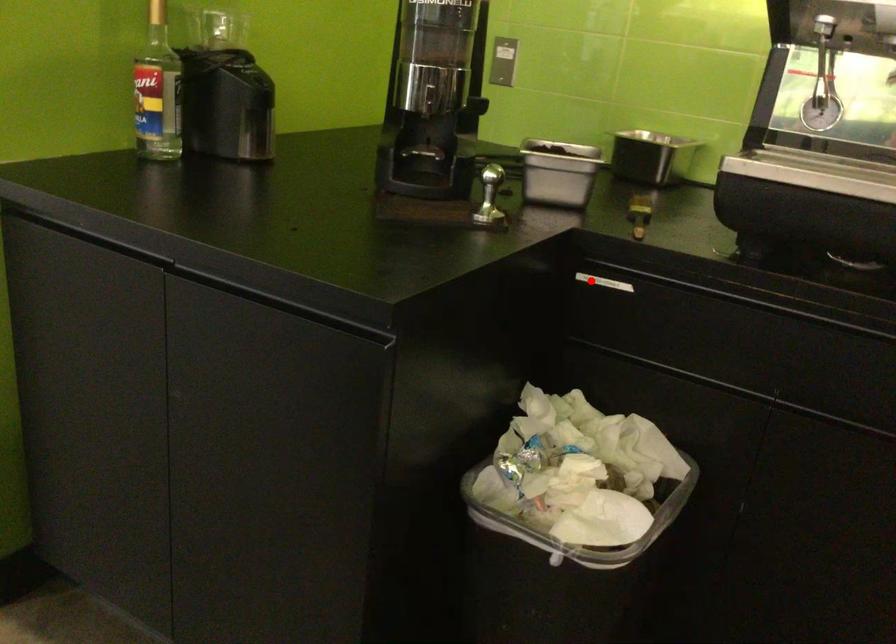
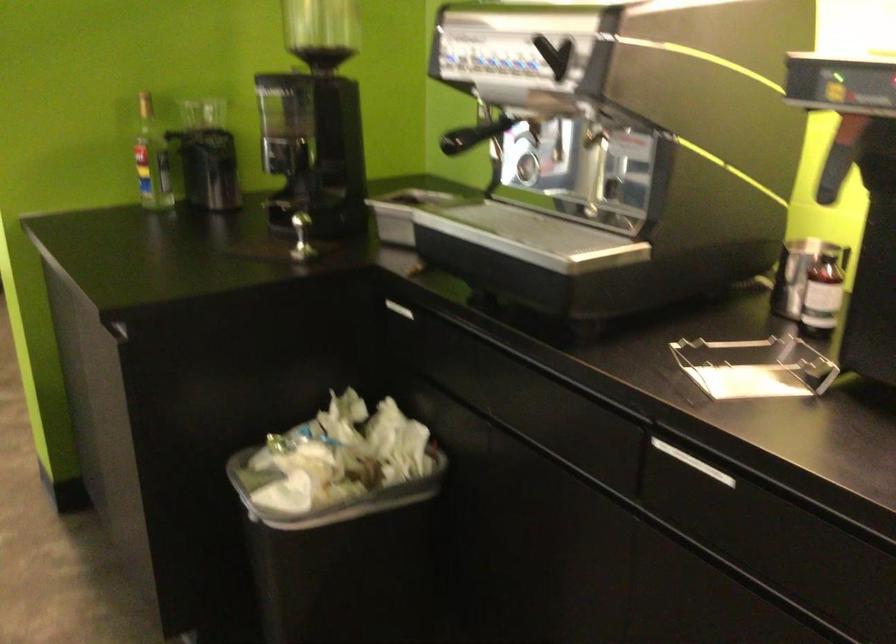
Question: I am providing you with two images of the same scene from different viewpoints. A red point is marked on the first image. At the location where the point appears in image 1, is it still visible in image 2?

Choices:
 (A) Yes
 (B) No

Answer: (A)